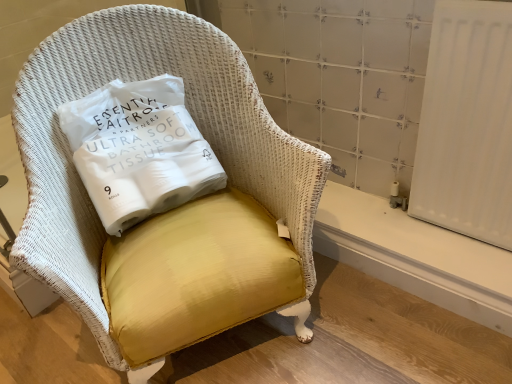
Question: Should I look upward or downward to see yellow fabric chair at center?

Choices:
 (A) up
 (B) down

Answer: (A)

Question: Does yellow fabric chair at center have a smaller size compared to white smooth radiator at lower right?

Choices:
 (A) no
 (B) yes

Answer: (A)

Question: Considering the relative positions of yellow fabric chair at center and white smooth radiator at lower right in the image provided, is yellow fabric chair at center behind white smooth radiator at lower right?

Choices:
 (A) yes
 (B) no

Answer: (B)

Question: Is yellow fabric chair at center oriented towards white smooth radiator at lower right?

Choices:
 (A) yes
 (B) no

Answer: (B)

Question: Can you confirm if yellow fabric chair at center is thinner than white smooth radiator at lower right?

Choices:
 (A) yes
 (B) no

Answer: (B)

Question: Considering the relative sizes of yellow fabric chair at center and white smooth radiator at lower right in the image provided, is yellow fabric chair at center wider than white smooth radiator at lower right?

Choices:
 (A) yes
 (B) no

Answer: (A)

Question: Is yellow fabric chair at center with white smooth radiator at lower right?

Choices:
 (A) yes
 (B) no

Answer: (B)

Question: Can you confirm if yellow fabric pillow at center is positioned to the right of yellow fabric chair at center?

Choices:
 (A) yes
 (B) no

Answer: (B)

Question: From a real-world perspective, is yellow fabric pillow at center located beneath yellow fabric chair at center?

Choices:
 (A) no
 (B) yes

Answer: (A)

Question: Considering the relative positions of yellow fabric pillow at center and yellow fabric chair at center in the image provided, is yellow fabric pillow at center behind yellow fabric chair at center?

Choices:
 (A) yes
 (B) no

Answer: (A)

Question: Can you confirm if yellow fabric pillow at center is taller than yellow fabric chair at center?

Choices:
 (A) no
 (B) yes

Answer: (A)

Question: From the image's perspective, is yellow fabric pillow at center under yellow fabric chair at center?

Choices:
 (A) yes
 (B) no

Answer: (B)

Question: Is yellow fabric pillow at center not within yellow fabric chair at center?

Choices:
 (A) yes
 (B) no

Answer: (B)

Question: Is white smooth radiator at lower right outside yellow fabric pillow at center?

Choices:
 (A) no
 (B) yes

Answer: (B)